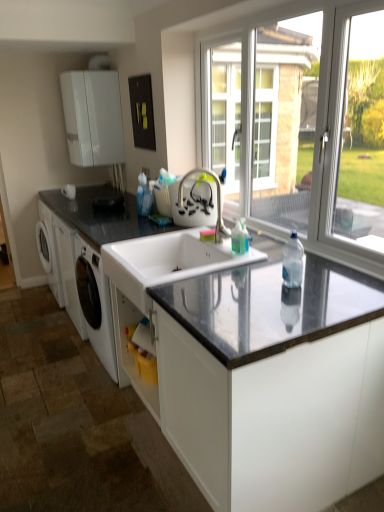
You are a GUI agent. You are given a task and a screenshot of the screen. Output one action in this format:
    pyautogui.click(x=<x>, y=<y>)
    Task: Click on the vacant space to the left of clear plastic bottle at center
    The height and width of the screenshot is (512, 384).
    Given the screenshot: What is the action you would take?
    [x=251, y=284]